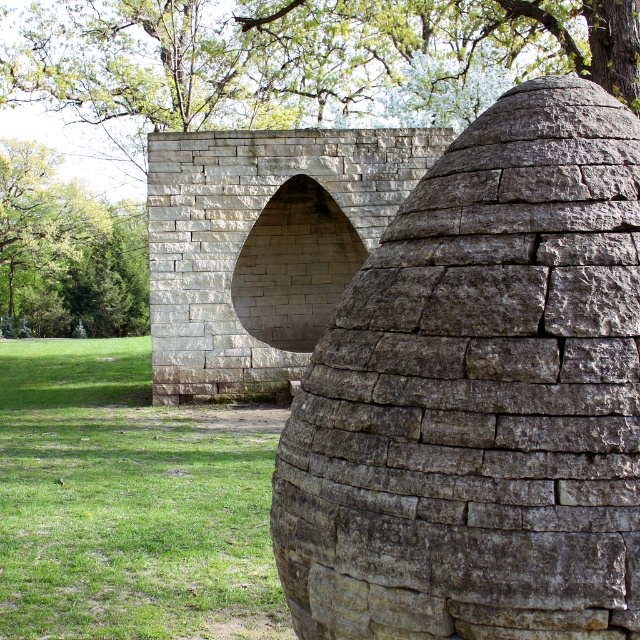
You are standing in the outdoor scene and want to place a small garden ornament. Which area would be more appropriate for placing it based on the size of the green grass at lower left and the green leafy tree at upper left?

The green grass at lower left is smaller than the green leafy tree at upper left, so the garden ornament should be placed near the green grass at lower left to maintain proportion.

You are standing in the outdoor scene and want to find shade from the sun. The gray stone dome at center and the green leafy tree at upper left are both nearby. Which object provides more shade coverage?

The gray stone dome at center is positioned under green leafy tree at upper left, so the tree likely provides more shade coverage as it is above the dome.